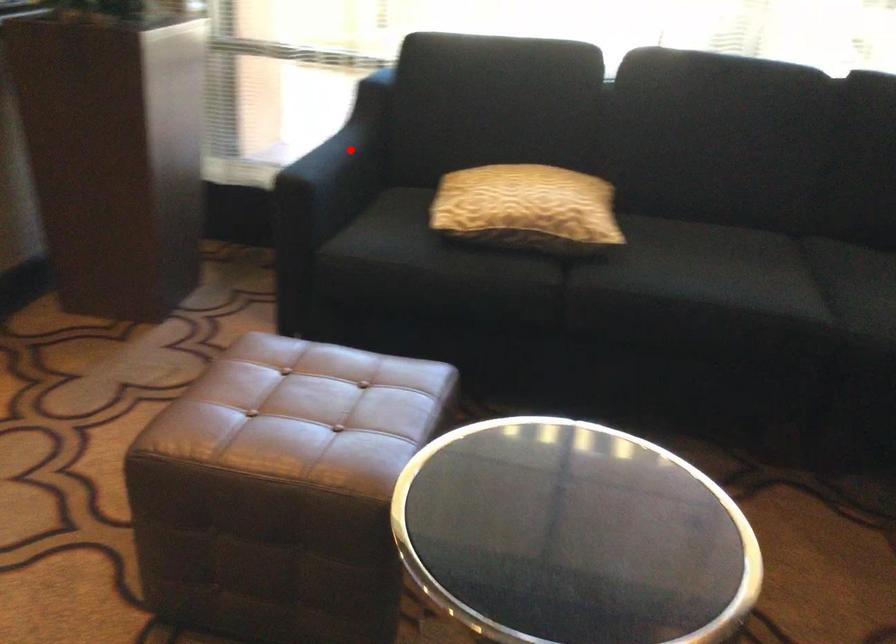
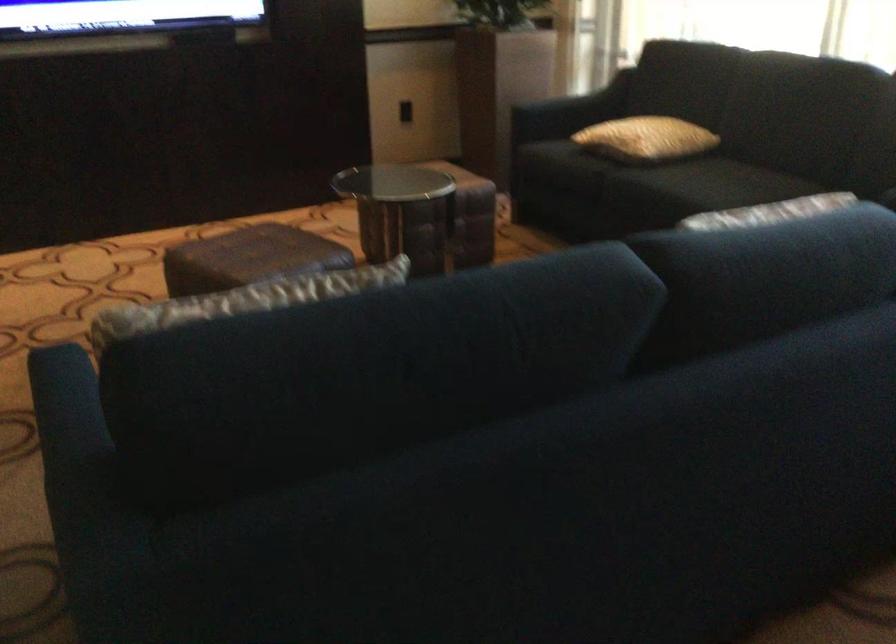
Question: A red point is marked in image1. In image2, is the corresponding 3D point closer to the camera or farther? Reply with the corresponding letter.

Choices:
 (A) The corresponding 3D point is closer.
 (B) The corresponding 3D point is farther.

Answer: (B)